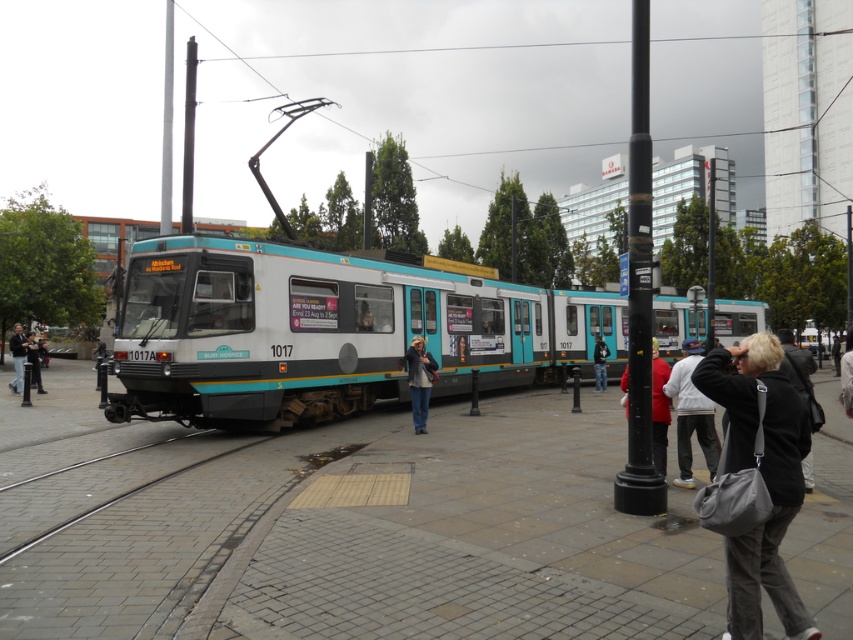
Is point (732, 611) closer to camera compared to point (10, 342)?

Yes, it is in front of point (10, 342).

Is black fabric bag at lower right to the right of jeans at left from the viewer's perspective?

Yes, black fabric bag at lower right is to the right of jeans at left.

Is point (758, 573) closer to camera compared to point (16, 376)?

Yes.

Where is `black fabric bag at lower right`? This screenshot has width=853, height=640. black fabric bag at lower right is located at coordinates (762, 477).

Is teal matte train at center above jeans at center?

Yes, teal matte train at center is above jeans at center.

At what (x,y) coordinates should I click in order to perform the action: click on teal matte train at center. Please return your answer as a coordinate pair (x, y). Looking at the image, I should click on 329,332.

Does black fabric backpack at lower right have a greater width compared to jeans at left?

No.

Who is more forward, (808, 470) or (15, 342)?

Positioned in front is point (808, 470).

Where is `black fabric backpack at lower right`? This screenshot has width=853, height=640. black fabric backpack at lower right is located at coordinates (796, 365).